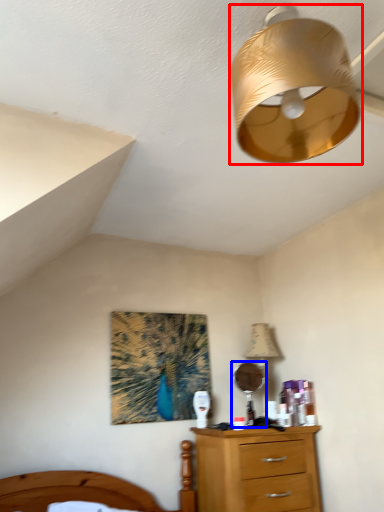
Question: Which object appears farthest to the camera in this image, lamp (highlighted by a red box) or mirror (highlighted by a blue box)?

Choices:
 (A) lamp
 (B) mirror

Answer: (B)